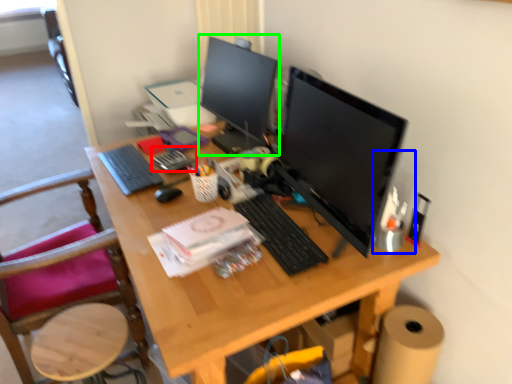
Question: Estimate the real-world distances between objects in this image. Which object is farther from stationery (highlighted by a red box), computer tower (highlighted by a blue box) or computer monitor (highlighted by a green box)?

Choices:
 (A) computer tower
 (B) computer monitor

Answer: (A)